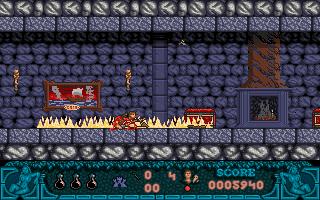
Find the location of `fireplace`. fireplace is located at coordinates (255, 107).